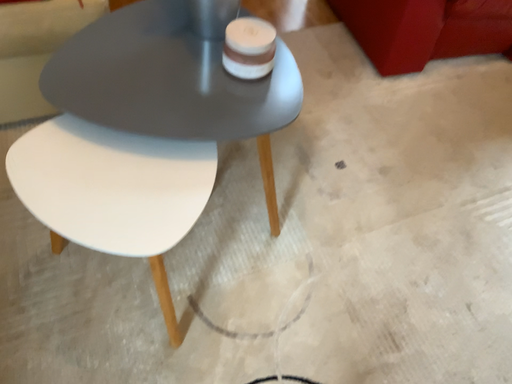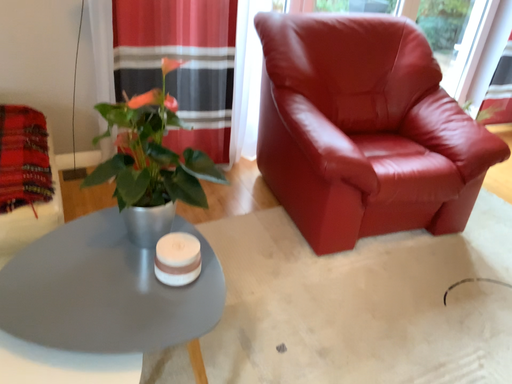
Question: How did the camera likely rotate when shooting the video?

Choices:
 (A) rotated downward
 (B) rotated upward

Answer: (B)